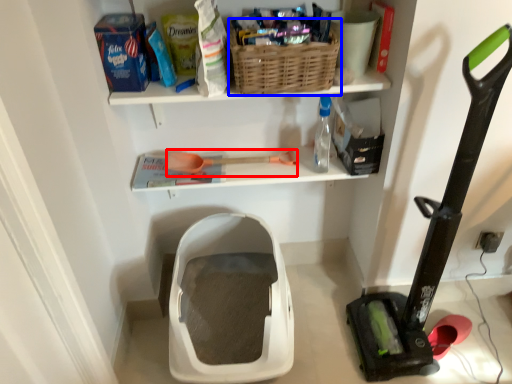
Question: Which object is closer to the camera taking this photo, tool (highlighted by a red box) or basket (highlighted by a blue box)?

Choices:
 (A) tool
 (B) basket

Answer: (B)